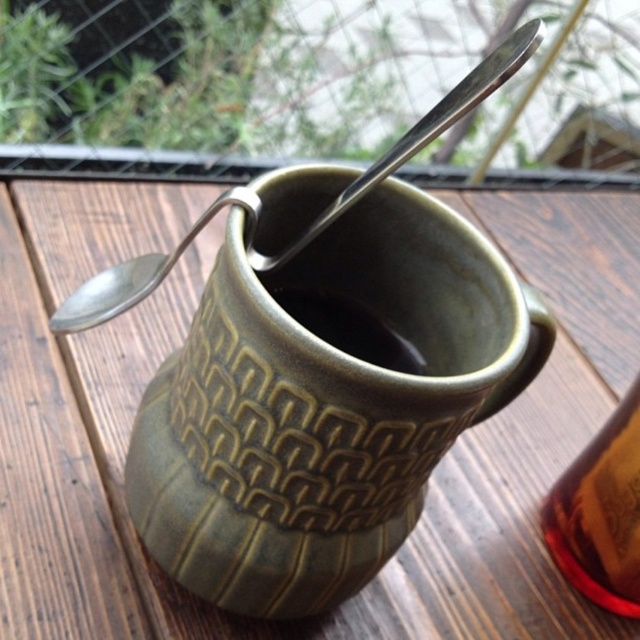
You are holding a ruler and want to measure the distance from your eyes to the green textured mug at center. If the ruler is 12 inches long, can you fully extend it to reach the mug?

The distance between the green textured mug at center and the viewer is 21.87 inches. Since the ruler is only 12 inches long, it cannot fully extend to measure the full distance. You would need a longer measuring tool.

Looking at this image, you are standing in front of the ceramic mug on the wooden surface. There is a point marked at coordinates (602, 513). What is located at that point?

The point at (602, 513) is on the translucent amber liquid at upper right.